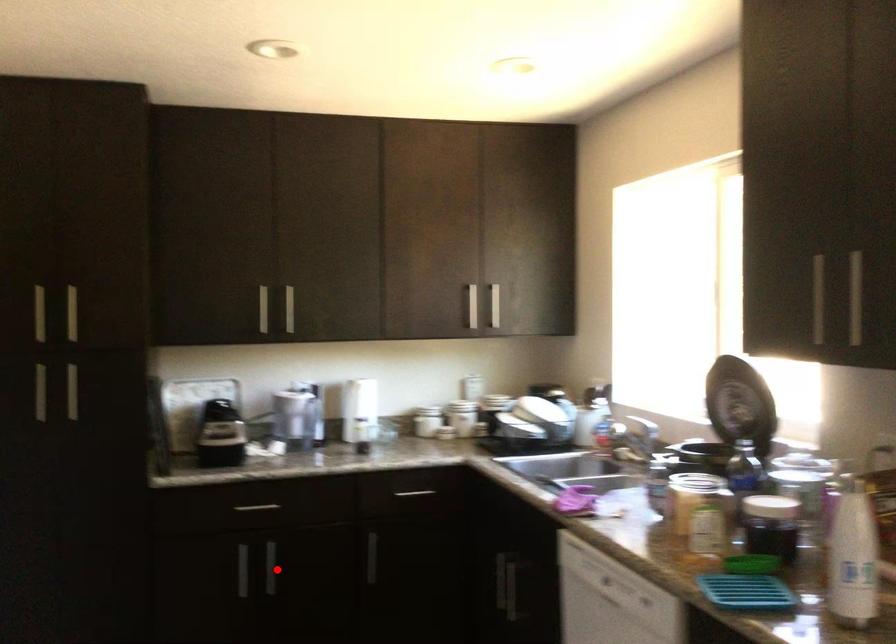
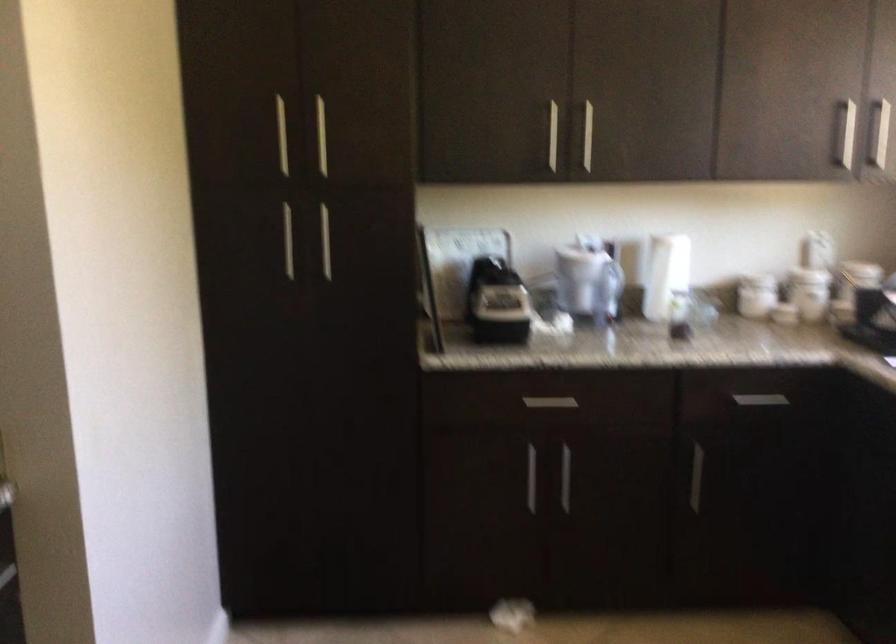
Question: I am providing you with two images of the same scene from different viewpoints. A red point is marked on the first image. Is the red point's position out of view in image 2?

Choices:
 (A) Yes
 (B) No

Answer: (B)